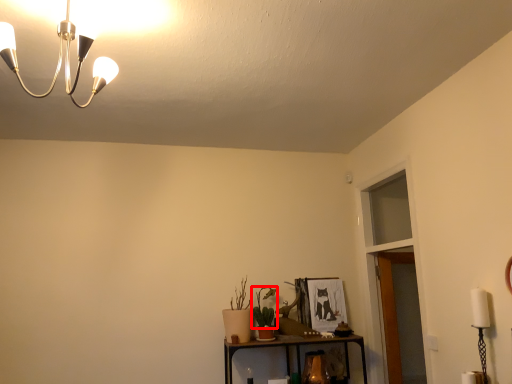
Question: From the image's perspective, what is the correct spatial relationship of plant (annotated by the red box) in relation to glass door?

Choices:
 (A) above
 (B) below

Answer: (B)